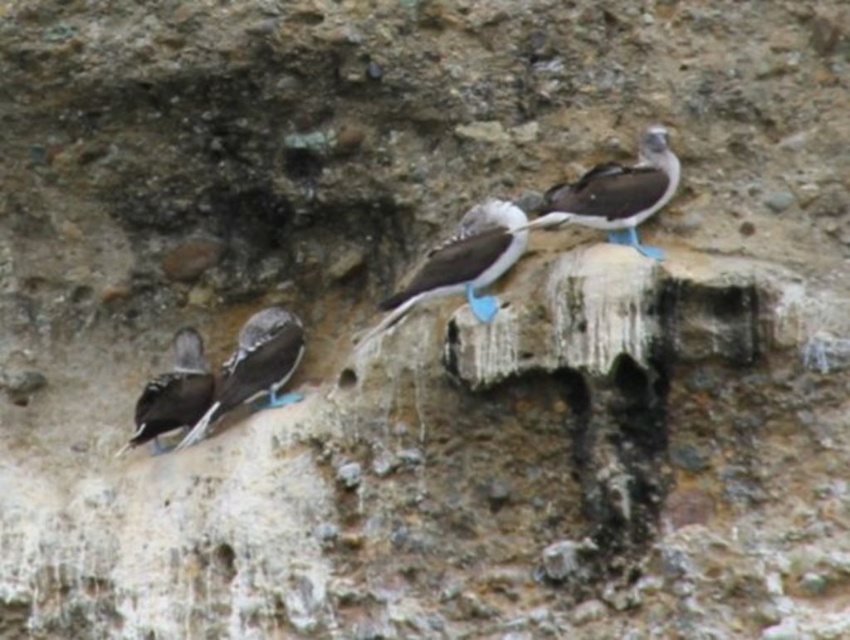
Question: Which object is positioned closest to the blue feathered bird at center?

Choices:
 (A) matte black bird at left
 (B) shiny black feathers at left

Answer: (B)

Question: Does white feathered bird at center have a greater width compared to blue feathered bird at center?

Choices:
 (A) no
 (B) yes

Answer: (A)

Question: Which point is farther to the camera?

Choices:
 (A) shiny black feathers at left
 (B) white feathered bird at center
 (C) blue feathered bird at center
 (D) matte black bird at left

Answer: (D)

Question: Does blue feathered bird at center appear over matte black bird at left?

Choices:
 (A) no
 (B) yes

Answer: (B)

Question: Can you confirm if white feathered bird at center is positioned to the right of shiny black feathers at left?

Choices:
 (A) no
 (B) yes

Answer: (B)

Question: Which of the following is the farthest from the observer?

Choices:
 (A) matte black bird at left
 (B) blue feathered bird at center
 (C) white feathered bird at center
 (D) shiny black feathers at left

Answer: (A)